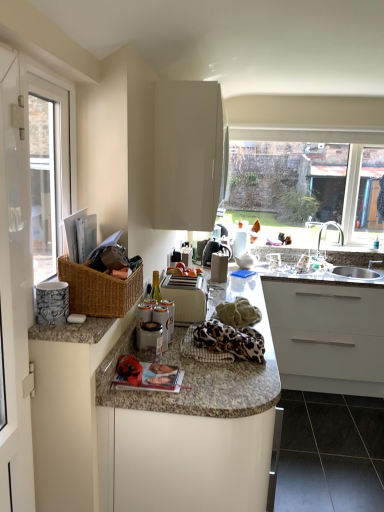
Question: From a real-world perspective, is silver metallic sink at right positioned above or below porcelain blue and white mug at left, which is counted as the second appliance, starting from the back?

Choices:
 (A) below
 (B) above

Answer: (A)

Question: Considering their positions, is silver metallic sink at right located in front of or behind porcelain blue and white mug at left, which is counted as the second appliance, starting from the back?

Choices:
 (A) behind
 (B) front

Answer: (A)

Question: Based on their relative distances, which object is farther from the porcelain blue and white mug at left, the first appliance viewed from the front?

Choices:
 (A) white glossy screen door at left
 (B) white plastic toaster at center, which is counted as the first appliance, starting from the back
 (C) white glossy cabinet at upper center, positioned as the 1th cabinetry in top-to-bottom order
 (D) silver metallic faucet at right
 (E) granite countertop at center, arranged as the second cabinetry when viewed from the top

Answer: (D)

Question: Which object is the closest to the silver metallic sink at right?

Choices:
 (A) porcelain blue and white mug at left, which is counted as the second appliance, starting from the back
 (B) white glossy screen door at left
 (C) leopard print fabric at center
 (D) granite countertop at center, arranged as the second cabinetry when viewed from the top
 (E) black glossy tile at lower right

Answer: (E)